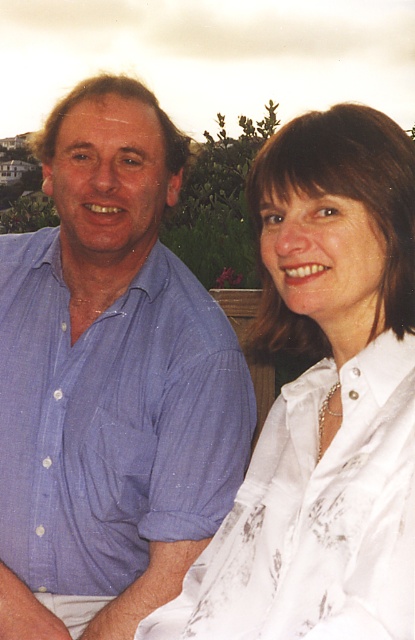
Does blue cotton shirt at left appear under white satin blouse at upper right?

Incorrect, blue cotton shirt at left is not positioned below white satin blouse at upper right.

Measure the distance between blue cotton shirt at left and camera.

The distance of blue cotton shirt at left from camera is 8.85 meters.

Does point (87, 186) come closer to viewer compared to point (336, 563)?

No.

Locate an element on the screen. blue cotton shirt at left is located at coordinates (110, 378).